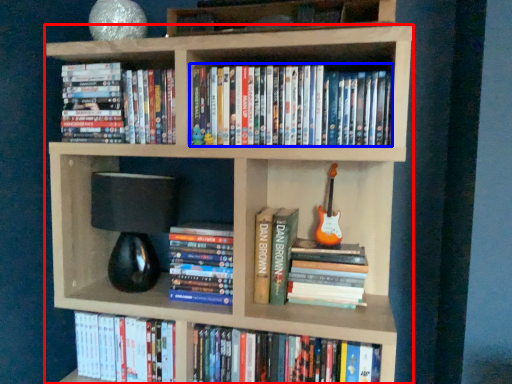
Question: Among these objects, which one is farthest to the camera, bookcase (highlighted by a red box) or book (highlighted by a blue box)?

Choices:
 (A) bookcase
 (B) book

Answer: (B)